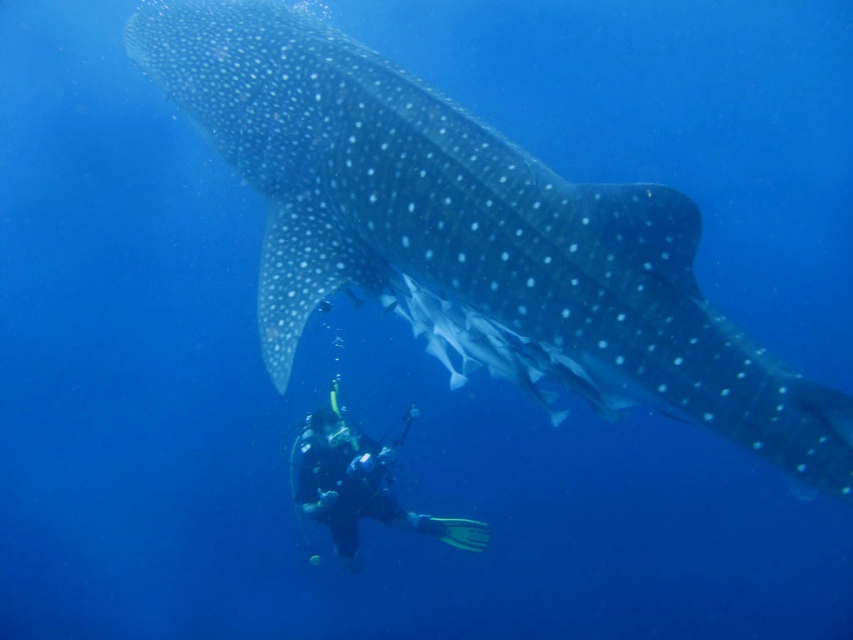
You are a marine biologist measuring the width of underwater creatures. You see the smooth gray shark at center and the black rubber wetsuit at lower center. Which one has a greater width?

The smooth gray shark at center has a greater width than the black rubber wetsuit at lower center.

You are a marine biologist studying the whale shark in the image. You need to place a tracking device on the smooth gray shark at center. The device must be placed at the point with coordinates point (x=467, y=225). Can you confirm the coordinates of the smooth gray shark at center?

The point (x=467, y=225) marks the smooth gray shark at center, so the coordinates are correct.

You are a marine biologist observing an underwater scene. You see a smooth gray shark at center and a black rubber wetsuit at lower center. Which object is taller in the image?

The smooth gray shark at center is much taller than the black rubber wetsuit at lower center.